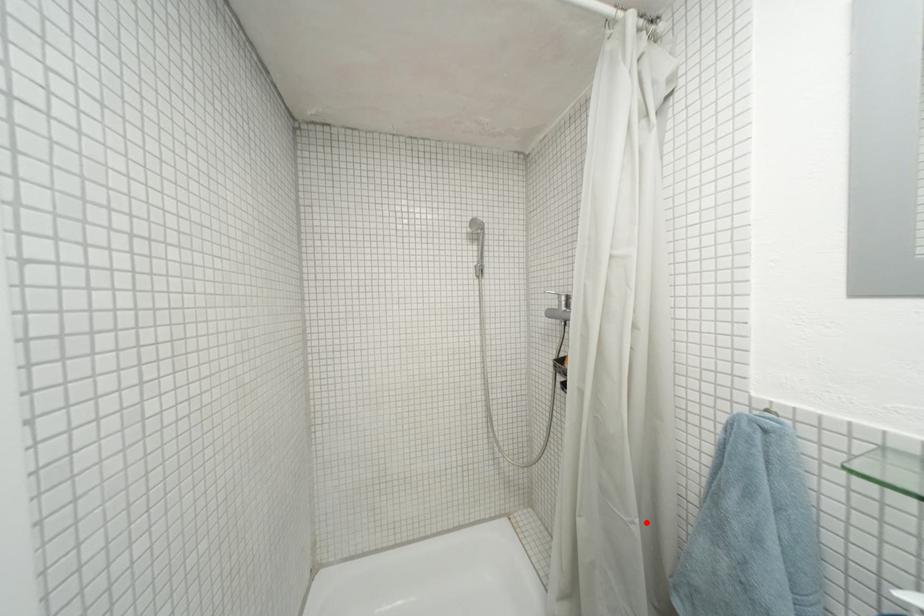
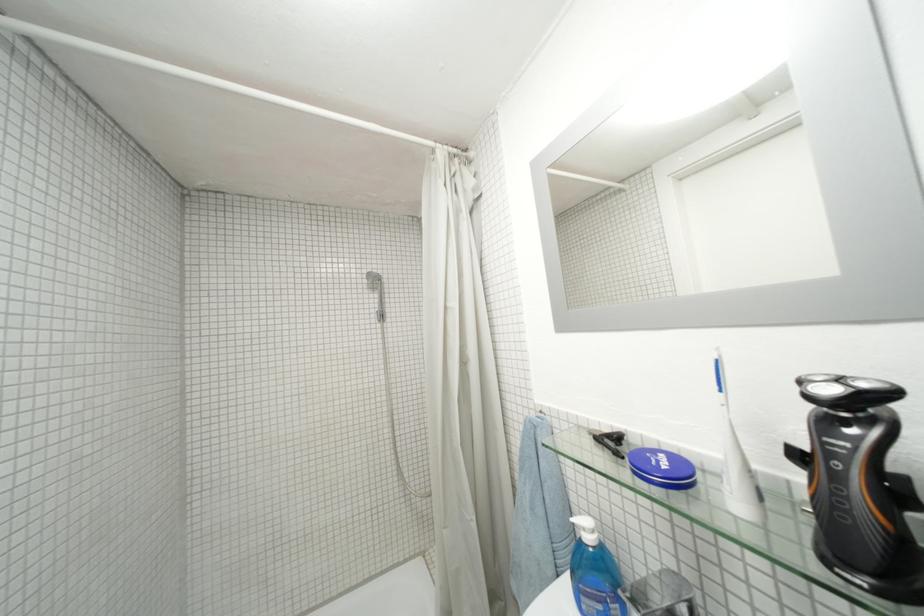
The point at the highlighted location is marked in the first image. Where is the corresponding point in the second image?

(482, 521)